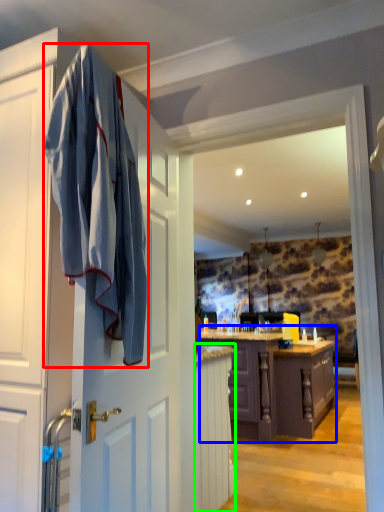
Question: Estimate the real-world distances between objects in this image. Which object is closer to bath towel (highlighted by a red box), cabinetry (highlighted by a blue box) or cabinetry (highlighted by a green box)?

Choices:
 (A) cabinetry
 (B) cabinetry

Answer: (B)